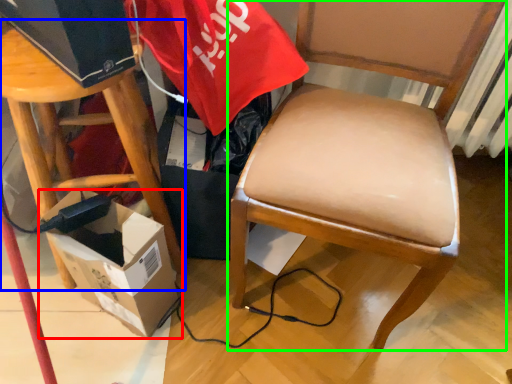
Question: Based on their relative distances, which object is farther from box (highlighted by a red box)? Choose from stool (highlighted by a blue box) and chair (highlighted by a green box).

Choices:
 (A) stool
 (B) chair

Answer: (B)